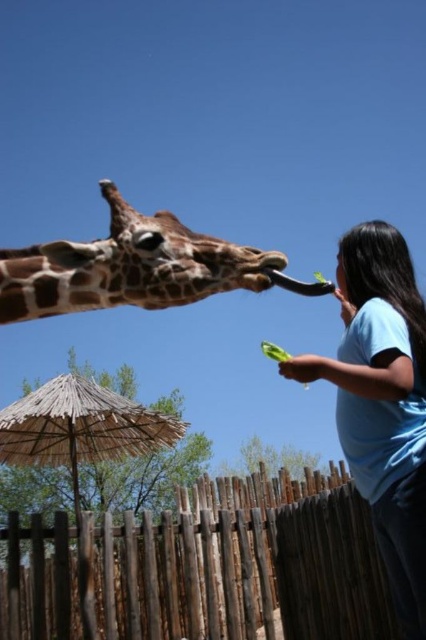
Question: Among these points, which one is nearest to the camera?

Choices:
 (A) (327, 515)
 (B) (118, 228)
 (C) (402, 372)

Answer: (C)

Question: Among these objects, which one is farthest from the camera?

Choices:
 (A) spotted brown giraffe at center
 (B) brown wooden fence at lower center
 (C) blue cotton shirt at right

Answer: (B)

Question: Is blue cotton shirt at right wider than spotted brown giraffe at center?

Choices:
 (A) yes
 (B) no

Answer: (B)

Question: Among these objects, which one is farthest from the camera?

Choices:
 (A) blue cotton shirt at right
 (B) spotted brown giraffe at center
 (C) brown wooden fence at lower center

Answer: (C)

Question: Can you confirm if blue cotton shirt at right is positioned to the right of spotted brown giraffe at center?

Choices:
 (A) yes
 (B) no

Answer: (A)

Question: Does brown wooden fence at lower center have a greater width compared to blue cotton shirt at right?

Choices:
 (A) no
 (B) yes

Answer: (A)